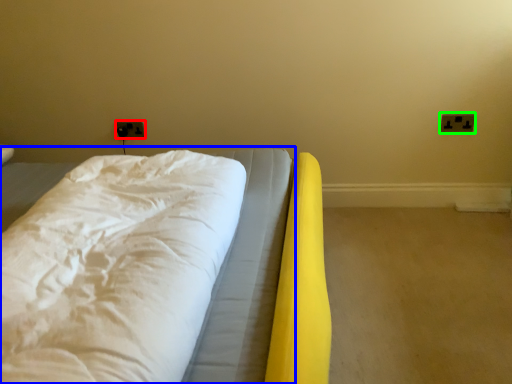
Question: Which is nearer to the electric outlet (highlighted by a red box)? bed (highlighted by a blue box) or electric outlet (highlighted by a green box).

Choices:
 (A) bed
 (B) electric outlet

Answer: (A)